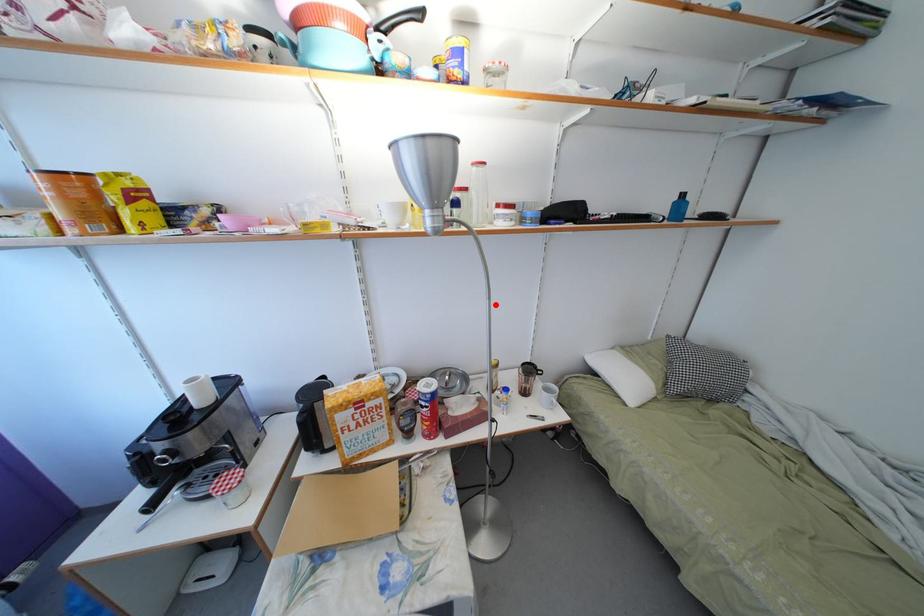
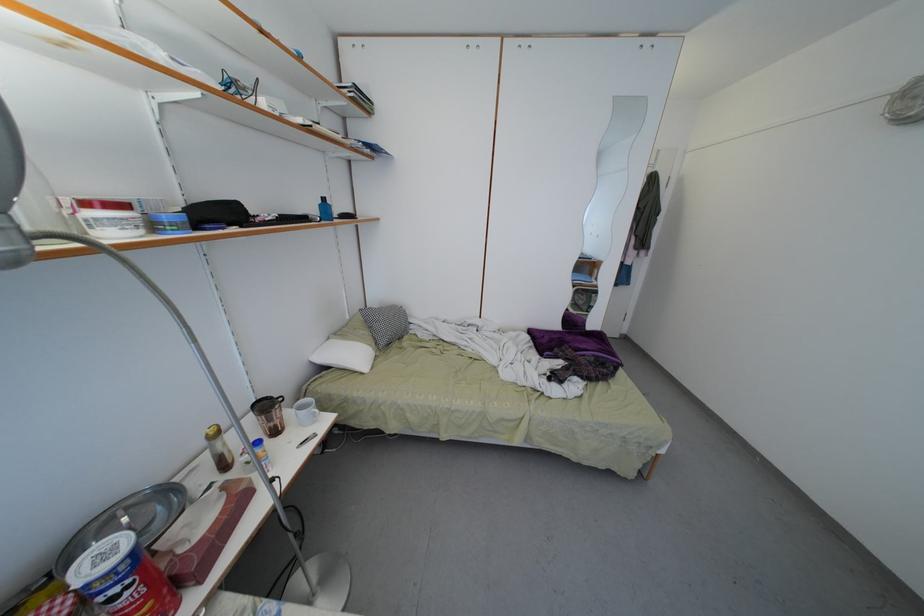
The point at the highlighted location is marked in the first image. Where is the corresponding point in the second image?

(201, 347)